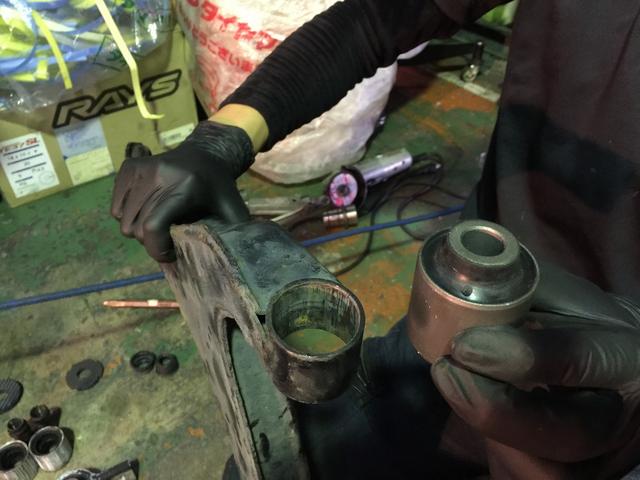
Locate an element on the screen. This screenshot has width=640, height=480. box is located at coordinates (123, 122).